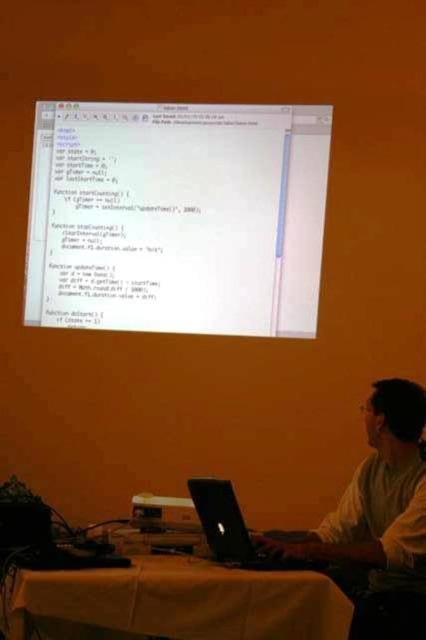
Question: From the image, what is the correct spatial relationship of white shirt at center in relation to black matte laptop at center?

Choices:
 (A) left
 (B) right

Answer: (B)

Question: Which point is closer to the camera?

Choices:
 (A) (71, 264)
 (B) (354, 604)
 (C) (147, 496)
 (D) (31, 580)

Answer: (D)

Question: Is the position of yellow fabric table at lower center less distant than that of matte black projector at center?

Choices:
 (A) no
 (B) yes

Answer: (B)

Question: Where is yellow fabric table at lower center located in relation to matte black projector at center in the image?

Choices:
 (A) above
 (B) below

Answer: (B)

Question: Which point is farther to the camera?

Choices:
 (A) (227, 560)
 (B) (169, 124)
 (C) (134, 518)
 (D) (385, 588)

Answer: (B)

Question: Estimate the real-world distances between objects in this image. Which object is closer to the black matte laptop at center?

Choices:
 (A) matte black projector at center
 (B) yellow fabric table at lower center
 (C) white shirt at center

Answer: (A)